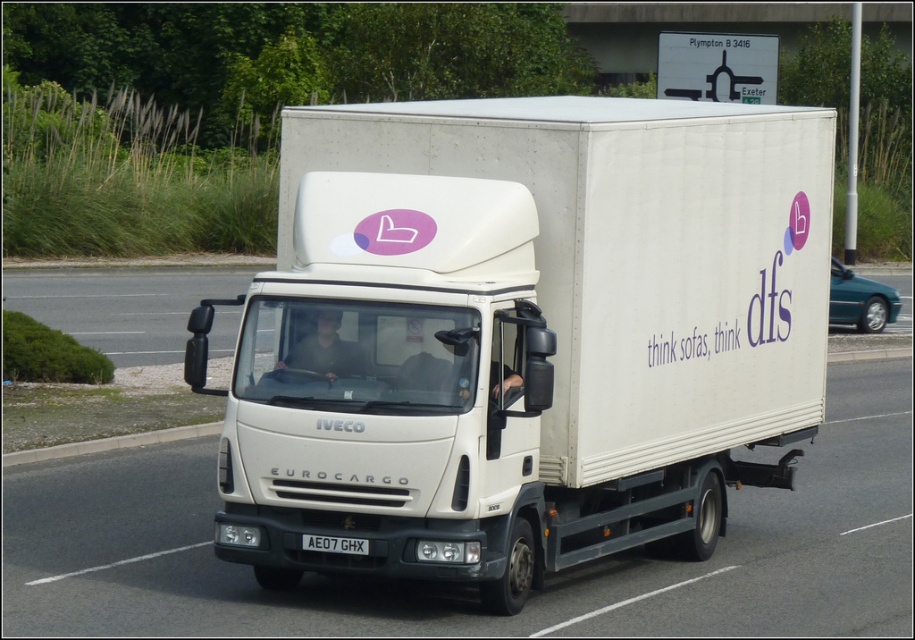
Is point (324, 262) positioned in front of point (302, 540)?

Yes, it is in front of point (302, 540).

Image resolution: width=915 pixels, height=640 pixels. Find the location of `white matte truck at center`. white matte truck at center is located at coordinates (522, 333).